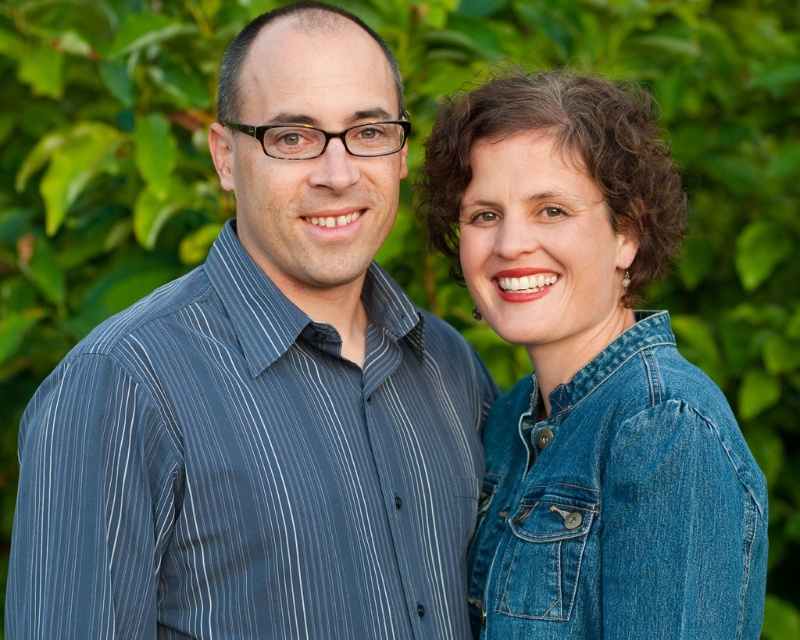
Between denim jacket at right and denim jacket at lower right, which one is positioned higher?

denim jacket at right is higher up.

Measure the distance between denim jacket at right and camera.

denim jacket at right and camera are 6.00 feet apart from each other.

Find the location of a particular element. denim jacket at right is located at coordinates (590, 376).

Which is above, blue striped shirt at left or denim jacket at lower right?

Positioned higher is blue striped shirt at left.

Which is in front, point (310, 540) or point (680, 403)?

Point (680, 403) is more forward.

Describe the element at coordinates (264, 394) in the screenshot. This screenshot has width=800, height=640. I see `blue striped shirt at left` at that location.

Where is `blue striped shirt at left`? This screenshot has width=800, height=640. blue striped shirt at left is located at coordinates [x=264, y=394].

Does blue striped shirt at left appear under denim jacket at right?

Correct, blue striped shirt at left is located below denim jacket at right.

Looking at this image, which is more to the right, blue striped shirt at left or denim jacket at right?

From the viewer's perspective, denim jacket at right appears more on the right side.

You are a GUI agent. You are given a task and a screenshot of the screen. Output one action in this format:
    pyautogui.click(x=<x>, y=<y>)
    Task: Click on the blue striped shirt at left
    
    Given the screenshot: What is the action you would take?
    point(264,394)